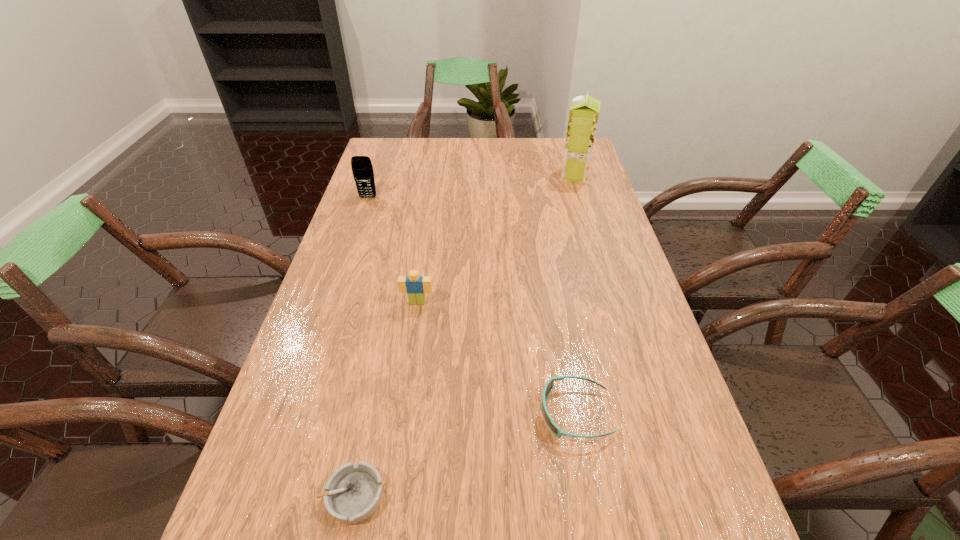
At what (x,y) coordinates should I click in order to perform the action: click on soya milk present at the right edge. Please return your answer as a coordinate pair (x, y). The width and height of the screenshot is (960, 540). Looking at the image, I should click on (584, 111).

This screenshot has width=960, height=540. Identify the location of sunglasses that is at the right edge. (549, 386).

In order to click on object that is at the far right corner in this screenshot , I will do `click(584, 111)`.

Identify the location of vacant space at the far edge of the desktop. (521, 157).

This screenshot has width=960, height=540. Identify the location of blank space at the left edge. (394, 191).

This screenshot has height=540, width=960. I want to click on free space at the right edge of the desktop, so click(629, 349).

Locate an element on the screen. empty space between the Lego and the tallest object is located at coordinates (496, 239).

Where is `vacant space that's between the sunglasses and the rightmost object`? vacant space that's between the sunglasses and the rightmost object is located at coordinates pyautogui.click(x=575, y=294).

Identify the location of vacant space in between the fourth object from left to right and the third tallest object. The image size is (960, 540). (496, 357).

Where is `free spot between the third farthest object and the ashtray`? The image size is (960, 540). free spot between the third farthest object and the ashtray is located at coordinates (385, 399).